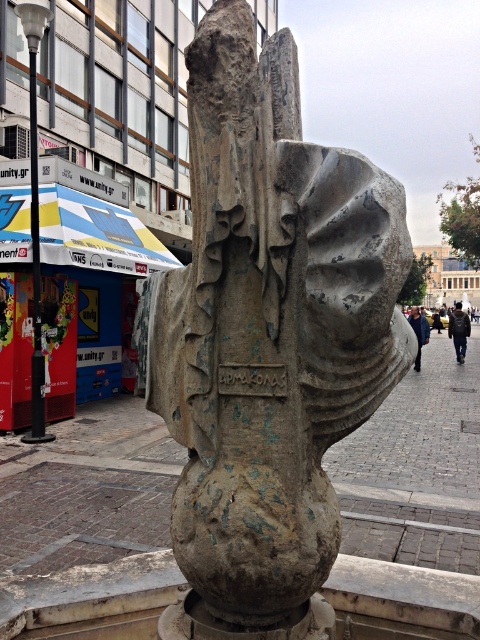
Question: Among these points, which one is farthest from the camera?

Choices:
 (A) (261, 205)
 (B) (433, 492)

Answer: (B)

Question: Is rusty stone sculpture at center positioned in front of brick pavement at center?

Choices:
 (A) no
 (B) yes

Answer: (B)

Question: Which of the following is the farthest from the observer?

Choices:
 (A) rusty stone sculpture at center
 (B) brick pavement at center

Answer: (B)

Question: Considering the relative positions of rusty stone sculpture at center and brick pavement at center in the image provided, where is rusty stone sculpture at center located with respect to brick pavement at center?

Choices:
 (A) left
 (B) right

Answer: (A)

Question: Where is rusty stone sculpture at center located in relation to brick pavement at center in the image?

Choices:
 (A) below
 (B) above

Answer: (B)

Question: Which point is closer to the camera?

Choices:
 (A) brick pavement at center
 (B) rusty stone sculpture at center

Answer: (B)